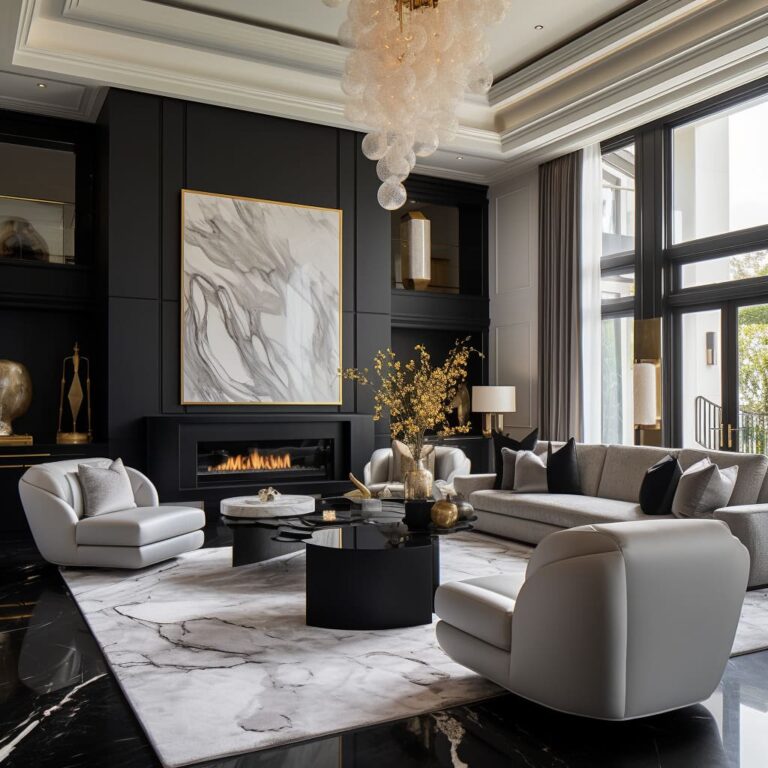
Locate an element on the screen. The height and width of the screenshot is (768, 768). rug is located at coordinates [x=242, y=650].